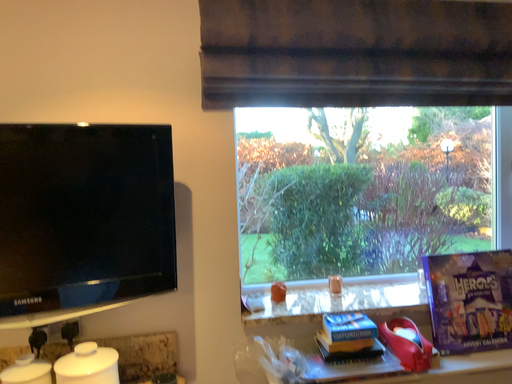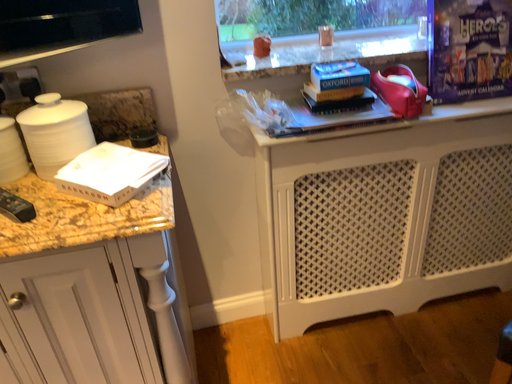
Question: Which way did the camera rotate in the video?

Choices:
 (A) rotated upward
 (B) rotated downward

Answer: (B)